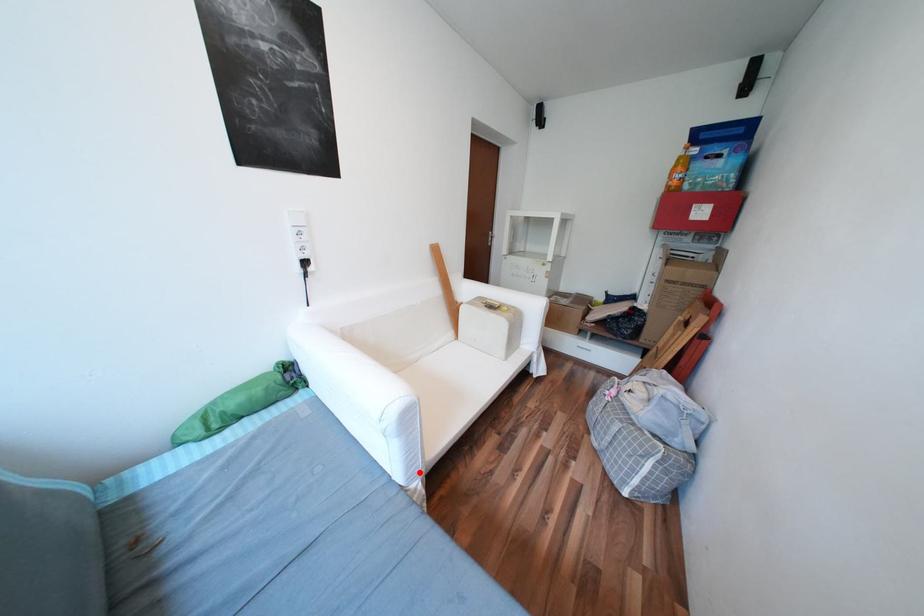
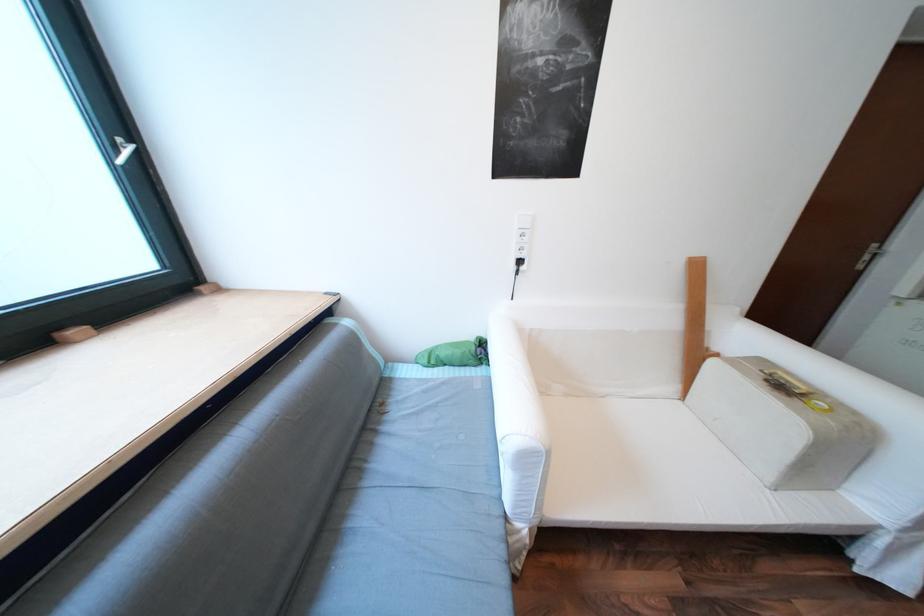
Question: I am providing you with two images of the same scene from different viewpoints. Image1 has a red point marked. In image2, the corresponding 3D location appears at what relative position? Reply with the corresponding letter.

Choices:
 (A) Closer
 (B) Farther

Answer: (B)